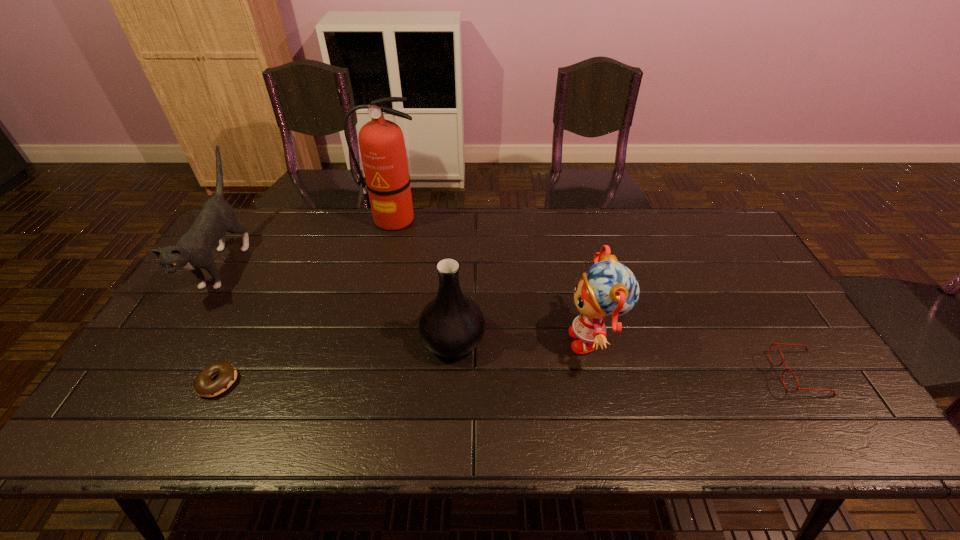
Identify the location of free space between the second object from left to right and the vase. tap(335, 361).

Where is `vacant space in between the second object from right to left and the vase`? This screenshot has width=960, height=540. vacant space in between the second object from right to left and the vase is located at coordinates (523, 340).

I want to click on free space between the vase and the leftmost object, so (339, 301).

Find the location of `empty space between the fifth tallest object and the shortest object`. empty space between the fifth tallest object and the shortest object is located at coordinates (509, 378).

What are the coordinates of `free space between the tallest object and the doughnut` in the screenshot? It's located at tap(305, 301).

You are a GUI agent. You are given a task and a screenshot of the screen. Output one action in this format:
    pyautogui.click(x=<x>, y=<y>)
    Task: Click on the vacant point located between the fourth object from left to right and the fire extinguisher
    The width and height of the screenshot is (960, 540).
    Given the screenshot: What is the action you would take?
    pyautogui.click(x=423, y=280)

Locate an element on the screen. free space between the doll and the cat is located at coordinates (409, 301).

Find the location of `empty location between the tallest object and the doll`. empty location between the tallest object and the doll is located at coordinates (493, 280).

Locate an element on the screen. free space between the doll and the cat is located at coordinates (409, 301).

Choose which object is the second nearest neighbor to the fourth object from left to right. Please provide its 2D coordinates. Your answer should be formatted as a tuple, i.e. [(x, y)], where the tuple contains the x and y coordinates of a point satisfying the conditions above.

[(382, 147)]